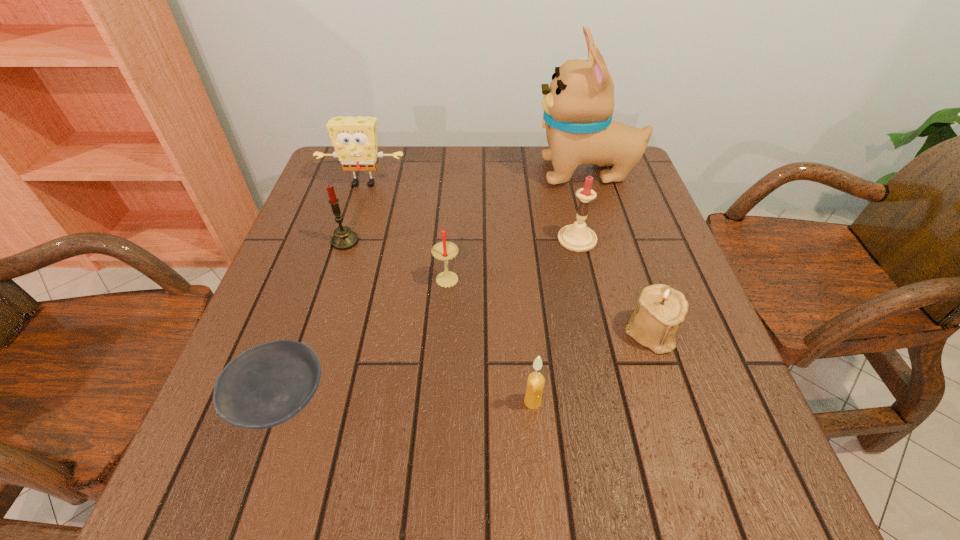
In the image, there is a desktop. At what (x,y) coordinates should I click in order to perform the action: click on free space at the near edge. Please return your answer as a coordinate pair (x, y). The image size is (960, 540). Looking at the image, I should click on (642, 459).

I want to click on free spot at the left edge of the desktop, so click(x=276, y=444).

The width and height of the screenshot is (960, 540). I want to click on vacant area at the right edge, so click(x=631, y=211).

In the image, there is a desktop. Where is `vacant space at the far right corner`? The height and width of the screenshot is (540, 960). vacant space at the far right corner is located at coordinates (603, 170).

What are the coordinates of `free space at the near right corner of the desktop` in the screenshot? It's located at (735, 494).

At what (x,y) coordinates should I click in order to perform the action: click on vacant area between the shortest object and the third farthest candle. Please return your answer as a coordinate pair (x, y). Looking at the image, I should click on (364, 339).

Locate an element on the screen. Image resolution: width=960 pixels, height=540 pixels. free space between the puppy and the bowl is located at coordinates (434, 287).

This screenshot has width=960, height=540. Identify the location of vacant area that lies between the fifth object from left to right and the rightmost candle. (555, 320).

Find the location of a particular element. free space that is in between the fifth object from left to right and the bowl is located at coordinates (407, 401).

At what (x,y) coordinates should I click in order to perform the action: click on free space between the sixth farthest object and the bowl. Please return your answer as a coordinate pair (x, y). Image resolution: width=960 pixels, height=540 pixels. Looking at the image, I should click on (467, 367).